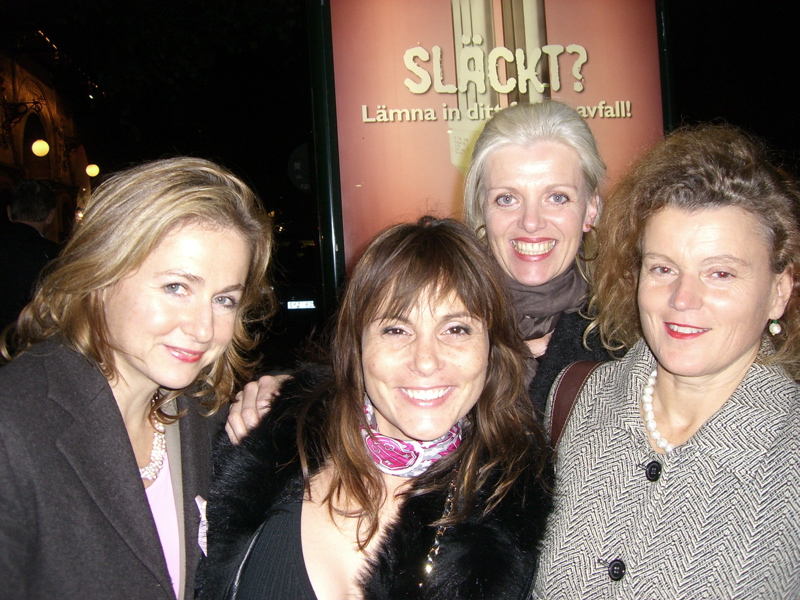
Identify the location of lights. This screenshot has width=800, height=600. (41, 160), (92, 171).